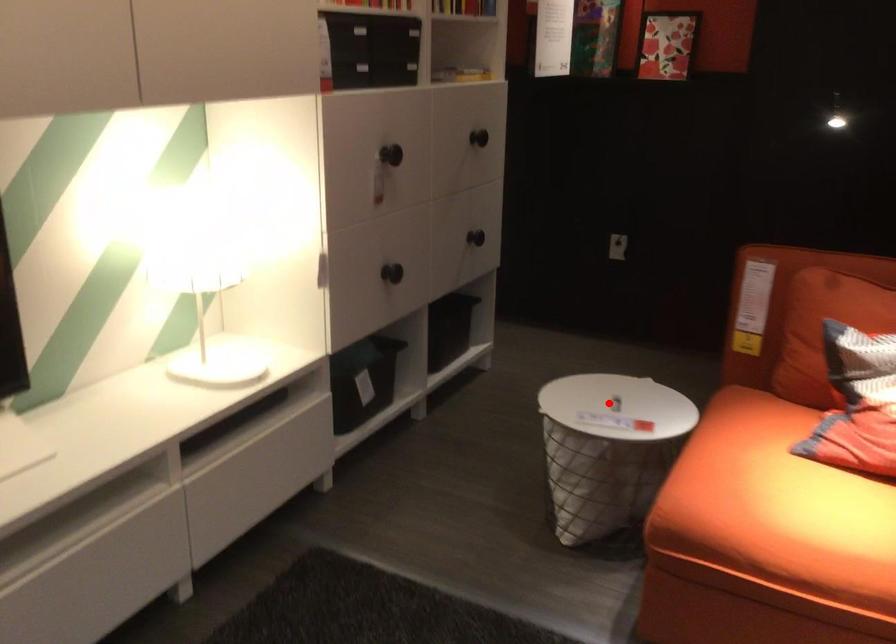
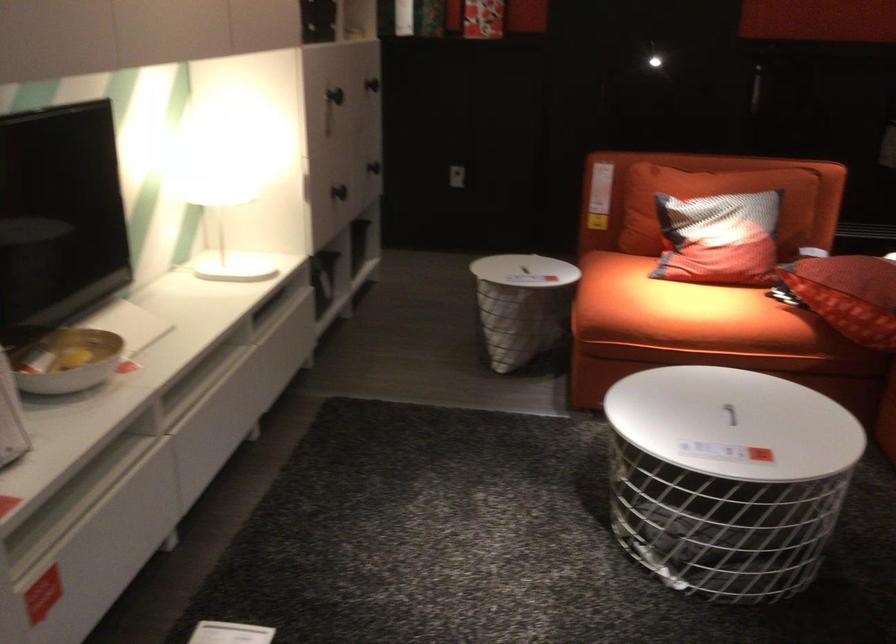
Question: I am providing you with two images of the same scene from different viewpoints. A red point is shown in image1. For the corresponding object point in image2, is it positioned nearer or farther from the camera?

Choices:
 (A) Nearer
 (B) Farther

Answer: (B)